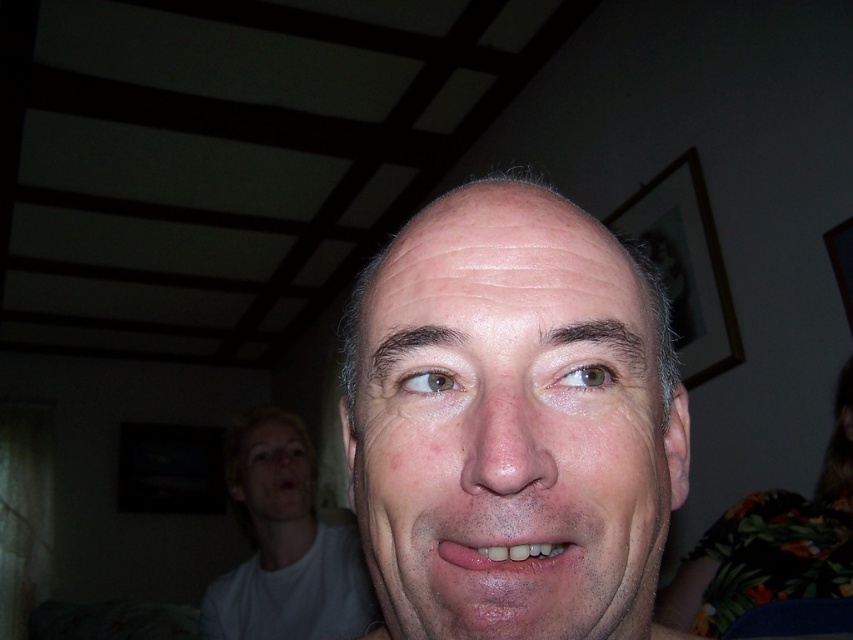
Between white matte face at center and smooth skin face at lower left, which one is positioned lower?

Positioned lower is white matte face at center.

Can you confirm if white matte face at center is smaller than smooth skin face at lower left?

No.

Measure the distance between white matte face at center and camera.

A distance of 4.90 feet exists between white matte face at center and camera.

You are a GUI agent. You are given a task and a screenshot of the screen. Output one action in this format:
    pyautogui.click(x=<x>, y=<y>)
    Task: Click on the white matte face at center
    
    Given the screenshot: What is the action you would take?
    pyautogui.click(x=285, y=545)

Is smooth skin face at center to the right of pink matte lips at center from the viewer's perspective?

Correct, you'll find smooth skin face at center to the right of pink matte lips at center.

Between smooth skin face at center and pink matte lips at center, which one has less height?

pink matte lips at center

What do you see at coordinates (512, 426) in the screenshot? This screenshot has height=640, width=853. I see `smooth skin face at center` at bounding box center [512, 426].

This screenshot has height=640, width=853. Identify the location of smooth skin face at center. pyautogui.click(x=512, y=426).

Does smooth skin face at lower left have a smaller size compared to pink matte lips at center?

Actually, smooth skin face at lower left might be larger than pink matte lips at center.

Which is more to the right, smooth skin face at lower left or pink matte lips at center?

Positioned to the right is pink matte lips at center.

Does point (245, 476) come behind point (535, 564)?

Yes, point (245, 476) is farther from viewer.

Where is `smooth skin face at lower left`? smooth skin face at lower left is located at coordinates (274, 474).